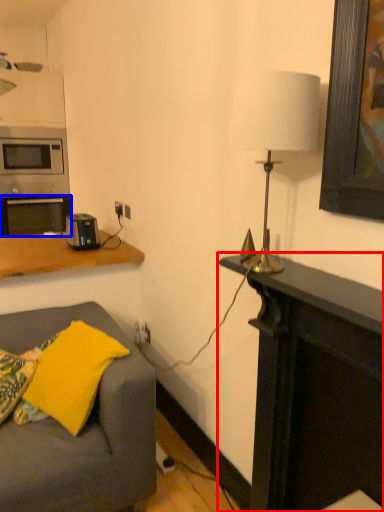
Question: Which of the following is the farthest to the observer, desk (highlighted by a red box) or oven (highlighted by a blue box)?

Choices:
 (A) desk
 (B) oven

Answer: (B)